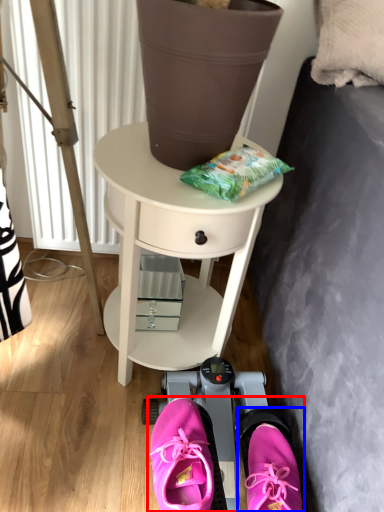
Question: Among these objects, which one is farthest to the camera, couple (highlighted by a red box) or footwear (highlighted by a blue box)?

Choices:
 (A) couple
 (B) footwear

Answer: (A)